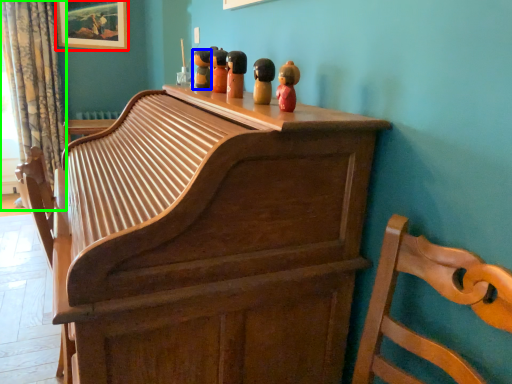
Question: Which object is positioned farthest from picture frame (highlighted by a red box)? Select from toy (highlighted by a blue box) and curtain (highlighted by a green box).

Choices:
 (A) toy
 (B) curtain

Answer: (A)